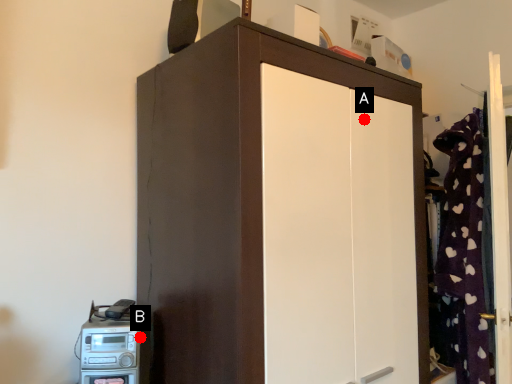
Question: Two points are circled on the image, labeled by A and B beside each circle. Among these points, which one is farthest from the camera?

Choices:
 (A) A is further
 (B) B is further

Answer: (A)